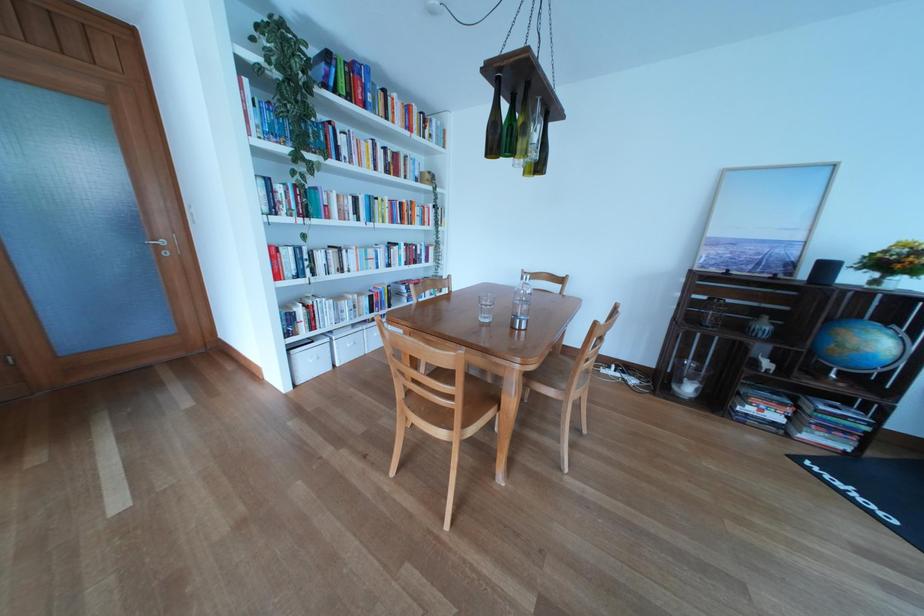
Where would you lift the glass flower vase? Please return your answer as a coordinate pair (x, y).

(687, 378)